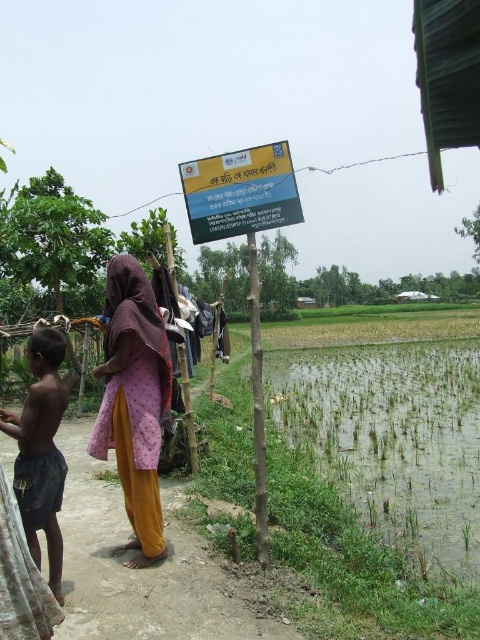
You are a photographer taking a picture of the scene. You notice the dark gray shorts at lower left and the pink fabric at center. Which object is closer to the left edge of the photo?

The dark gray shorts at lower left is positioned on the left side of pink fabric at center, so it is closer to the left edge of the photo.